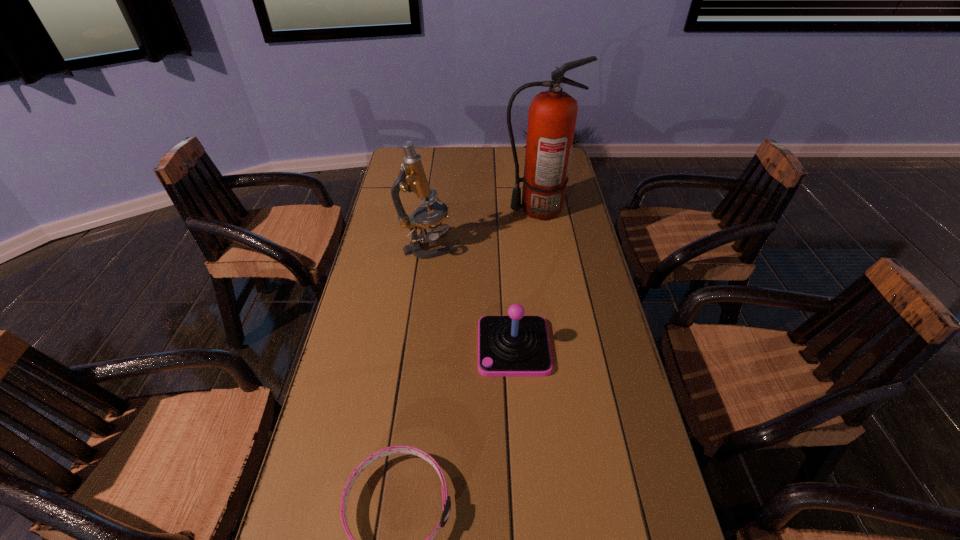
You are a GUI agent. You are given a task and a screenshot of the screen. Output one action in this format:
    pyautogui.click(x=<x>, y=<y>)
    Task: Click on the free region located forward from the base of the second nearest object
    
    Given the screenshot: What is the action you would take?
    pyautogui.click(x=411, y=347)

The width and height of the screenshot is (960, 540). Find the location of `free point located forward from the base of the second nearest object`. free point located forward from the base of the second nearest object is located at coordinates (444, 347).

Locate an element on the screen. This screenshot has height=540, width=960. vacant space positioned 0.080m forward from the base of the second nearest object is located at coordinates (448, 347).

The width and height of the screenshot is (960, 540). What are the coordinates of `object situated at the left edge` in the screenshot? It's located at (412, 178).

The width and height of the screenshot is (960, 540). What are the coordinates of `object that is at the right edge` in the screenshot? It's located at (552, 115).

Where is `vacant space at the far edge of the desktop`? This screenshot has width=960, height=540. vacant space at the far edge of the desktop is located at coordinates (482, 148).

Identify the location of vacant space at the left edge. The height and width of the screenshot is (540, 960). (397, 234).

Locate an element on the screen. vacant space at the right edge of the desktop is located at coordinates (555, 319).

In the image, there is a desktop. Where is `free space at the far right corner`? This screenshot has width=960, height=540. free space at the far right corner is located at coordinates (570, 172).

You are a GUI agent. You are given a task and a screenshot of the screen. Output one action in this format:
    pyautogui.click(x=<x>, y=<y>)
    Task: Click on the free space between the second shortest object and the microscope
    This screenshot has height=540, width=960.
    Given the screenshot: What is the action you would take?
    pyautogui.click(x=470, y=297)